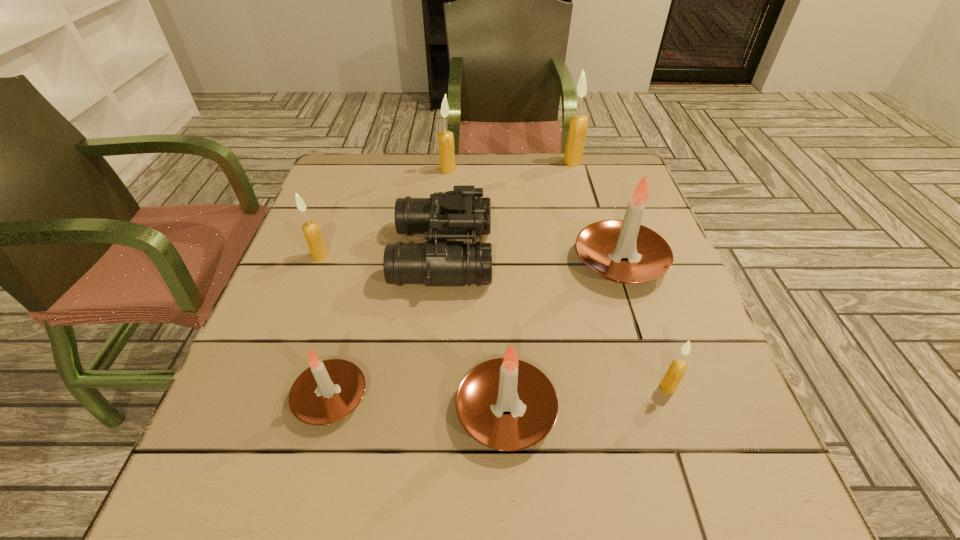
I want to click on blue binoculars, so tap(458, 214).

This screenshot has width=960, height=540. Find the location of `the leftmost white candle`. the leftmost white candle is located at coordinates (326, 392).

At what (x,y) coordinates should I click in order to perform the action: click on the smallest white candle. Please return your answer as a coordinate pair (x, y). Looking at the image, I should click on (x=326, y=392).

Identify the location of the rightmost cream candle. (677, 369).

Where is `the smallest cream candle`? This screenshot has height=540, width=960. the smallest cream candle is located at coordinates (677, 369).

Where is `vacant space located 0.200m on the front of the tallest candle`? The width and height of the screenshot is (960, 540). vacant space located 0.200m on the front of the tallest candle is located at coordinates (586, 207).

Find the location of `free region located on the left of the rightmost white candle`. free region located on the left of the rightmost white candle is located at coordinates (396, 262).

Where is `free spot located 0.070m on the right of the third cream candle from right to left`? Image resolution: width=960 pixels, height=540 pixels. free spot located 0.070m on the right of the third cream candle from right to left is located at coordinates (480, 170).

Where is `blank area located 0.220m on the back of the leftmost object`? blank area located 0.220m on the back of the leftmost object is located at coordinates (343, 196).

Find the location of `blank area located 0.070m on the right of the second smallest white candle`. blank area located 0.070m on the right of the second smallest white candle is located at coordinates (597, 410).